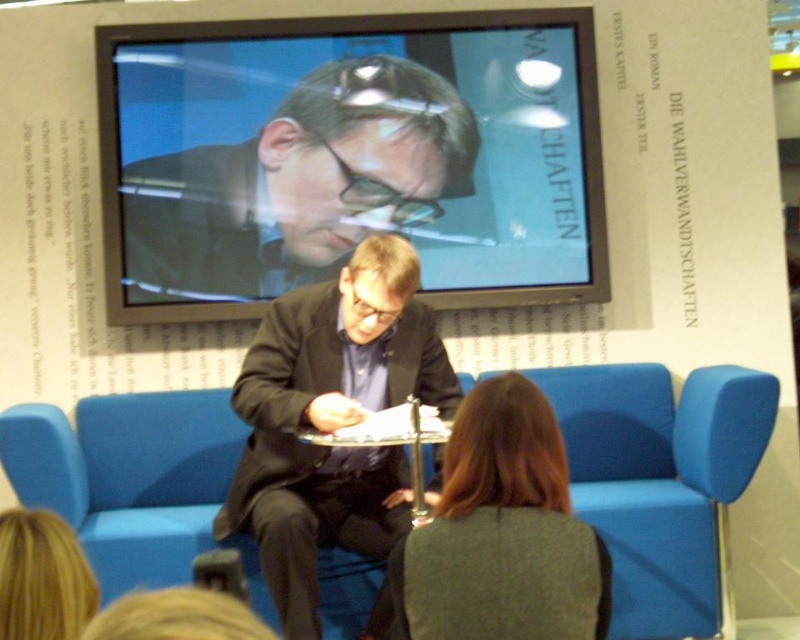
You are at a book fair and see two people in the image. The first person has dark brown hair at center and the second has blonde hair at lower left. Which person is positioned lower in the image?

The dark brown hair at center is positioned lower in the image than the blonde hair at lower left.

You are attending a book fair and notice the matte black screen at upper center and the dark brown suit at center. Which object is smaller in size?

The matte black screen at upper center is smaller in size compared to the dark brown suit at center.